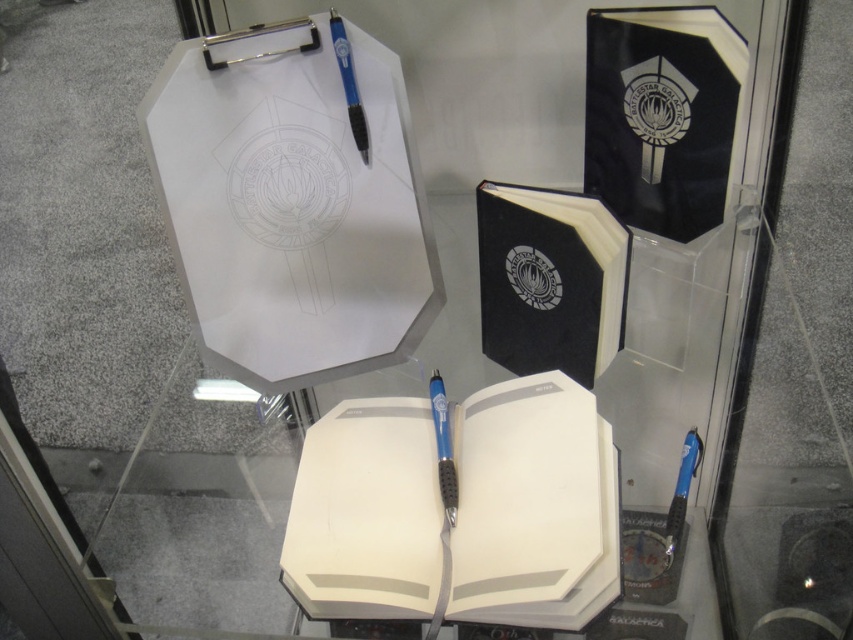
Question: Can you confirm if white matte notebook at center is positioned above black matte clipboard at center?

Choices:
 (A) no
 (B) yes

Answer: (A)

Question: Which point is farther to the camera?

Choices:
 (A) (434, 419)
 (B) (486, 342)
 (C) (700, 452)
 (D) (334, 588)

Answer: (B)

Question: Is white matte notebook at center in front of blue metallic pen at center?

Choices:
 (A) yes
 (B) no

Answer: (A)

Question: Is blue plastic pen at upper center below blue plastic pen at lower right?

Choices:
 (A) no
 (B) yes

Answer: (A)

Question: Considering the real-world distances, which object is closest to the white matte notebook at center?

Choices:
 (A) blue plastic pen at upper center
 (B) black matte clipboard at center
 (C) blue plastic pen at lower right
 (D) blue metallic pen at center

Answer: (D)

Question: Which point appears closest to the camera in this image?

Choices:
 (A) (434, 422)
 (B) (675, 492)

Answer: (A)